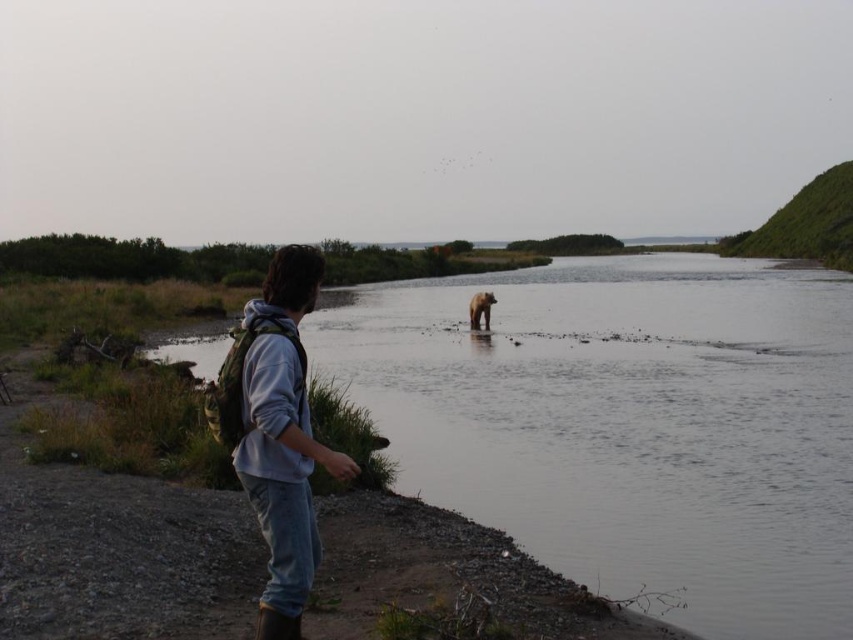
You are a hiker who just noticed a bear in the water. You are wearing denim pants at center and see the brown furry bear at center. Based on your position, can you confirm if you are closer to the bear than the edge of the water?

The denim pants at center is in front of brown furry bear at center, which means you are closer to the bear than the edge of the water since your pants are positioned in front of the bear.

You are standing at the point labeled point (x=471, y=317) and want to move towards the point labeled point (x=294, y=477). Is there a clear path between these two points without going through the bear in the water?

Point (x=294, y=477) is in front of point (x=471, y=317). Since the bear is in the water near the center of the frame, it is likely blocking the path between these two points, so the path may not be clear.

You are a hiker trying to cross the river. You see the brown fur river at center and the denim pants at center. Which path should you take to avoid getting your clothes wet?

The brown fur river at center might be wider than denim pants at center, so the denim pants at center is narrower and safer to cross without getting clothes wet.